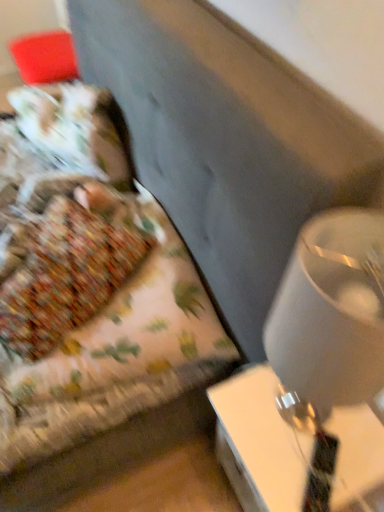
Where is `free spot above white glossy table at lower right (from a real-world perspective)`? This screenshot has width=384, height=512. free spot above white glossy table at lower right (from a real-world perspective) is located at coordinates [x=303, y=435].